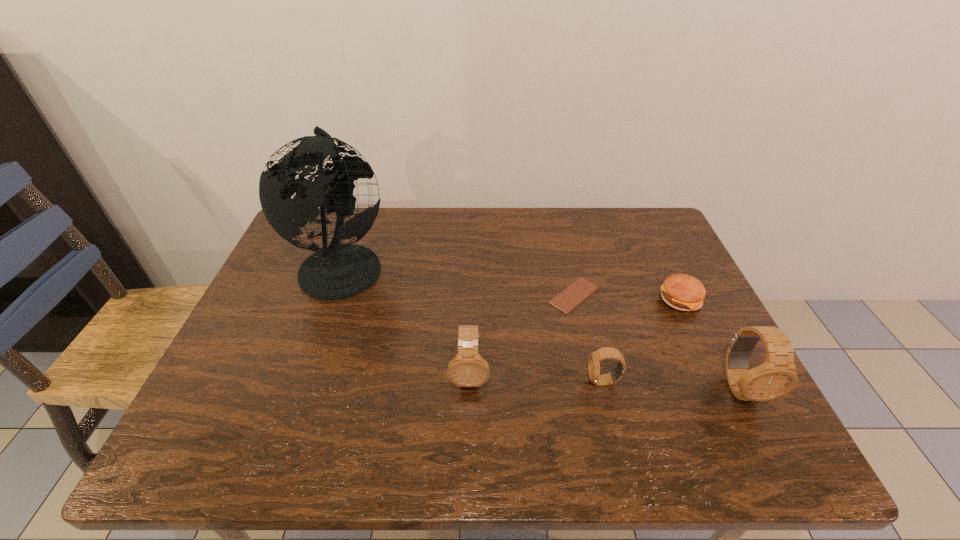
Where is `free region located 0.160m on the face of the second watch from right to left`? free region located 0.160m on the face of the second watch from right to left is located at coordinates (515, 381).

Find the location of a particular element. This screenshot has width=960, height=540. vacant space located 0.100m on the face of the second watch from right to left is located at coordinates (542, 381).

Locate an element on the screen. free point located 0.240m on the back of the second shortest object is located at coordinates (649, 233).

Locate an element on the screen. The image size is (960, 540). free location located 0.070m on the front-facing side of the tallest object is located at coordinates pos(417,265).

Locate an element on the screen. Image resolution: width=960 pixels, height=540 pixels. free location located 0.190m on the right of the shortest object is located at coordinates (673, 295).

Find the location of a particular element. object at the far edge is located at coordinates (339, 271).

Locate an element on the screen. The height and width of the screenshot is (540, 960). object present at the left edge is located at coordinates (339, 271).

Find the location of a particular element. watch that is at the right edge is located at coordinates (777, 376).

I want to click on hamburger that is at the right edge, so click(x=683, y=292).

This screenshot has width=960, height=540. I want to click on object situated at the far left corner, so click(x=339, y=271).